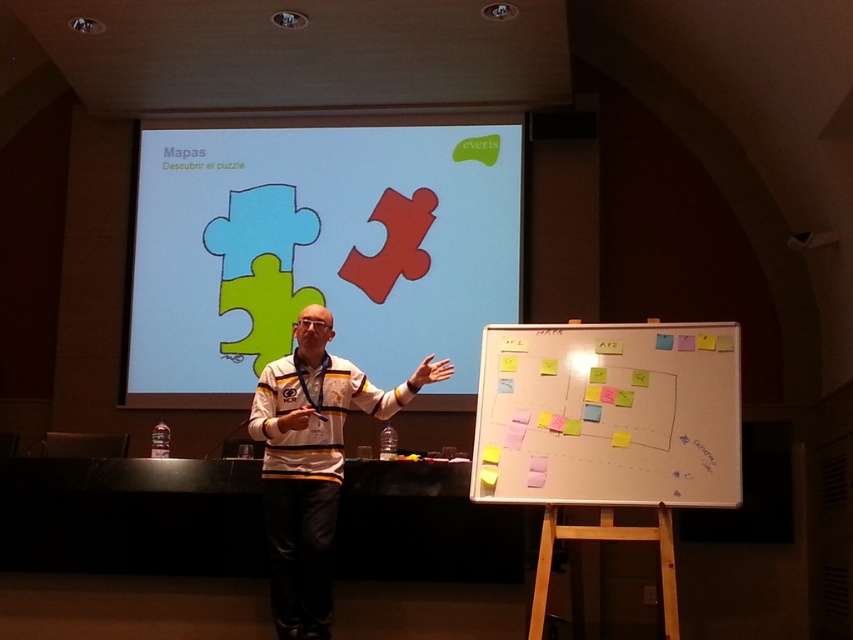
You are an attendee in the presentation and want to see both the matte plastic puzzle pieces at center and the whiteboard paper at center clearly. Which object is closer to you?

The matte plastic puzzle pieces at center are closer to you because the whiteboard paper at center is behind them.

You are an attendee in the presentation and you see the matte plastic puzzle pieces at center. Where exactly are they located in the room?

The matte plastic puzzle pieces at center are located at point [318,252] in the room.